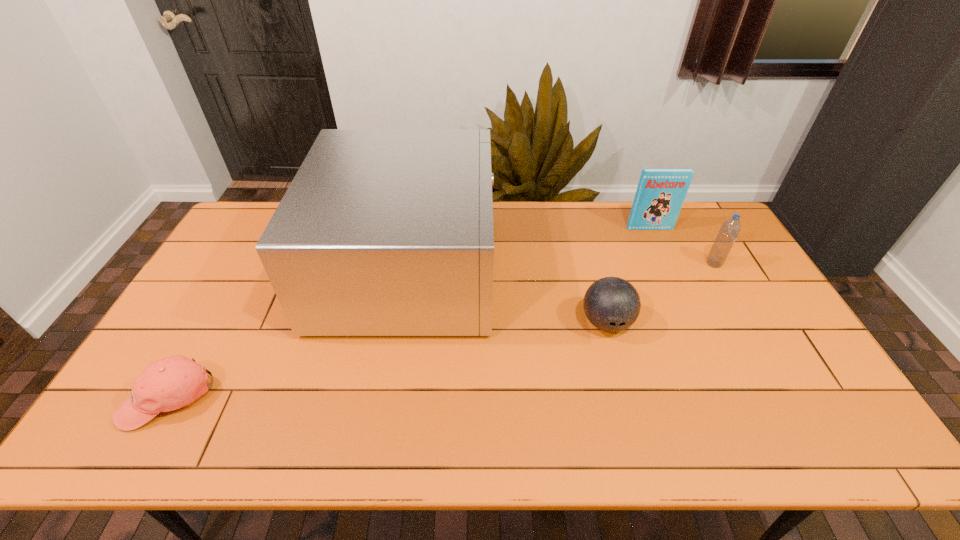
Locate an element on the screen. vacant area situated 0.160m with the door open on the microwave oven is located at coordinates (543, 268).

The height and width of the screenshot is (540, 960). What are the coordinates of `free space located on the front cover of the book` in the screenshot? It's located at (659, 248).

Locate an element on the screen. This screenshot has width=960, height=540. free space located on the left of the water bottle is located at coordinates (690, 264).

Where is `vacant space located 0.270m on the grip area of the second shortest object`? Image resolution: width=960 pixels, height=540 pixels. vacant space located 0.270m on the grip area of the second shortest object is located at coordinates (637, 438).

You are a GUI agent. You are given a task and a screenshot of the screen. Output one action in this format:
    pyautogui.click(x=<x>, y=<y>)
    Task: Click on the free location located on the right of the leftmost object
    The height and width of the screenshot is (540, 960).
    Given the screenshot: What is the action you would take?
    pyautogui.click(x=257, y=397)

Where is `microwave oven present at the far edge`? This screenshot has height=540, width=960. microwave oven present at the far edge is located at coordinates (382, 232).

This screenshot has height=540, width=960. In order to click on book positioned at the far edge in this screenshot , I will do `click(660, 194)`.

This screenshot has width=960, height=540. I want to click on object located in the near edge section of the desktop, so click(167, 384).

This screenshot has width=960, height=540. I want to click on object positioned at the left edge, so click(167, 384).

The height and width of the screenshot is (540, 960). I want to click on object that is positioned at the right edge, so click(728, 233).